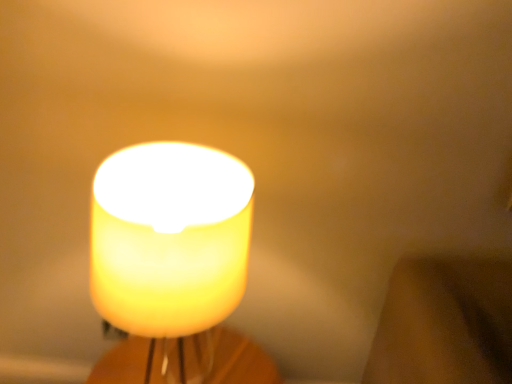
Question: Is translucent yellow candle at center shorter than translucent glass candle at center?

Choices:
 (A) no
 (B) yes

Answer: (A)

Question: From a real-world perspective, is translucent yellow candle at center on top of translucent glass candle at center?

Choices:
 (A) yes
 (B) no

Answer: (A)

Question: Is the surface of translucent yellow candle at center in direct contact with translucent glass candle at center?

Choices:
 (A) yes
 (B) no

Answer: (B)

Question: Could you tell me if translucent yellow candle at center is turned towards translucent glass candle at center?

Choices:
 (A) yes
 (B) no

Answer: (B)

Question: Is translucent yellow candle at center taller than translucent glass candle at center?

Choices:
 (A) no
 (B) yes

Answer: (B)

Question: Is translucent yellow candle at center closer to the viewer compared to translucent glass candle at center?

Choices:
 (A) no
 (B) yes

Answer: (B)

Question: From a real-world perspective, is translucent glass candle at center physically below translucent yellow candle at center?

Choices:
 (A) yes
 (B) no

Answer: (A)

Question: From the image's perspective, is translucent glass candle at center located beneath translucent yellow candle at center?

Choices:
 (A) no
 (B) yes

Answer: (B)

Question: Does translucent glass candle at center have a greater height compared to translucent yellow candle at center?

Choices:
 (A) no
 (B) yes

Answer: (A)

Question: Is translucent glass candle at center to the right of translucent yellow candle at center from the viewer's perspective?

Choices:
 (A) no
 (B) yes

Answer: (A)

Question: Does translucent glass candle at center lie in front of translucent yellow candle at center?

Choices:
 (A) no
 (B) yes

Answer: (A)

Question: Considering the relative sizes of translucent glass candle at center and translucent yellow candle at center in the image provided, is translucent glass candle at center smaller than translucent yellow candle at center?

Choices:
 (A) yes
 (B) no

Answer: (A)

Question: Is translucent yellow candle at center in front of or behind translucent glass candle at center in the image?

Choices:
 (A) behind
 (B) front

Answer: (B)